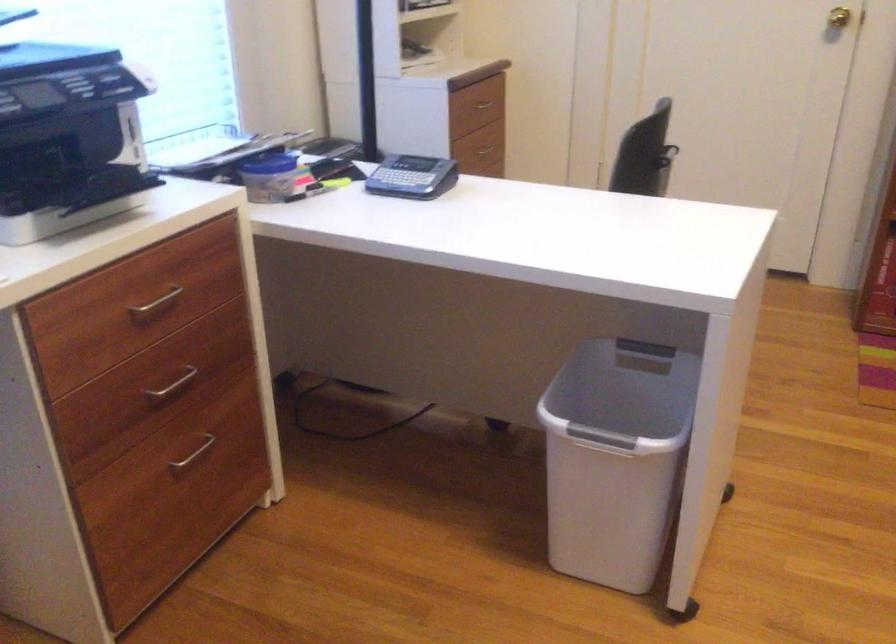
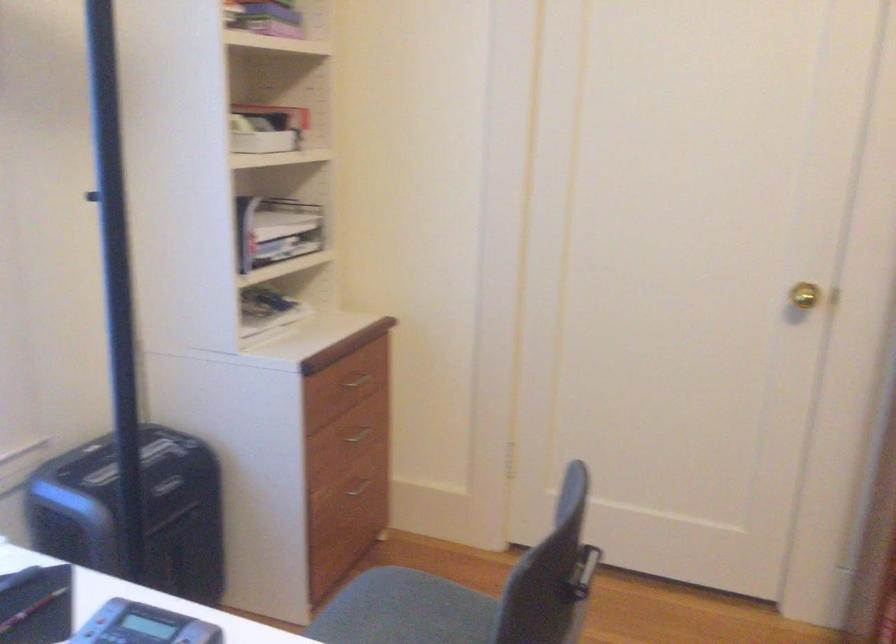
Where in the second image is the point corresponding to [478,147] from the first image?

(357, 431)